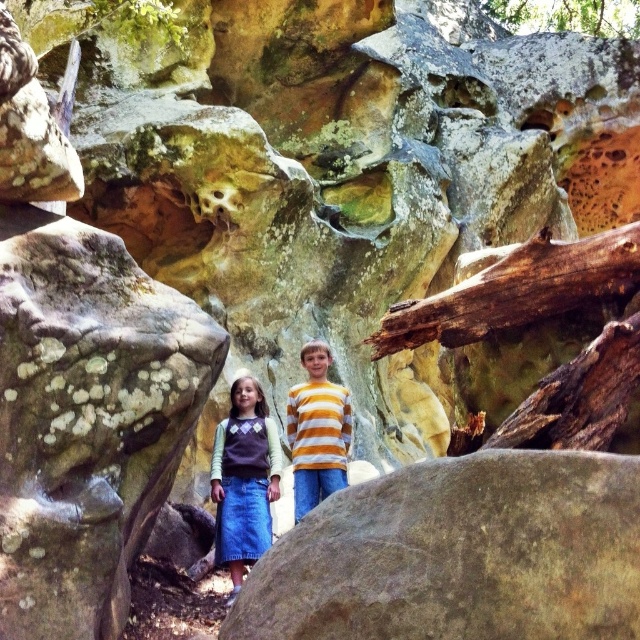
You are a hiker who wants to take a photo of the striped cotton shirt at center and the green leafy tree at upper right in the same frame. Based on their distance, will you be able to capture both in one photo without moving your camera?

The striped cotton shirt at center is 364.32 feet away from the green leafy tree at upper right. Since the distance between them is quite large, you might need to use a wide angle lens or move closer to ensure both are in the same frame.

In the scene shown: You are standing in the rocky landscape and want to place a small flag at the point closer to you between the two points marked as point (328, 412) and point (620, 12). Which point should you choose?

Point (328, 412) is closer to the viewer than point (620, 12), so you should choose point (328, 412) to place the flag.

You are a photographer trying to capture a photo of the speckled stone boulder at center and the yellow striped shirt at center. Based on their sizes, which object should you focus on first if you want to ensure both are in the frame without cropping?

The speckled stone boulder at center is taller than the yellow striped shirt at center, so you should focus on the speckled stone boulder at center first to ensure it fits within the frame.